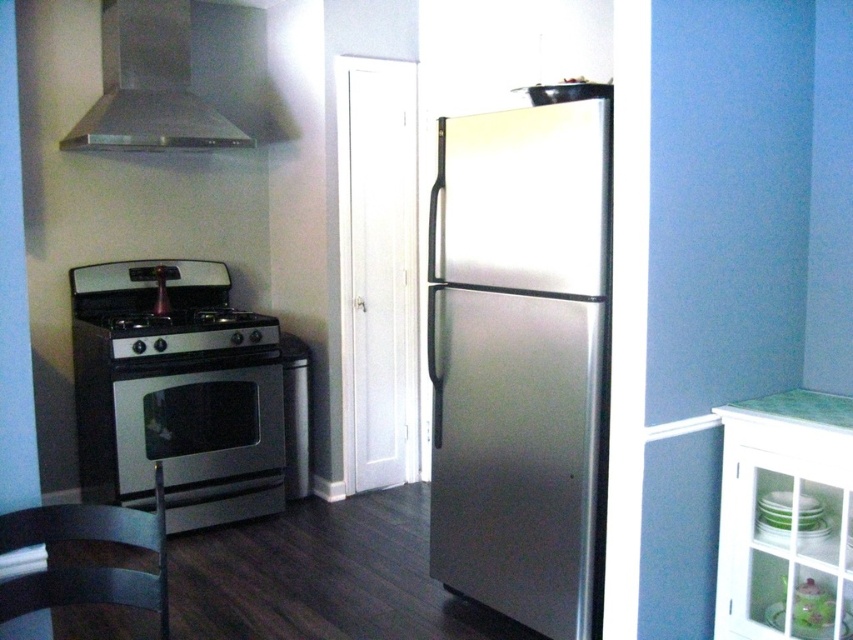
Based on the photo, you are standing in the kitchen and want to grab a snack from the refrigerator. Which object is closer to you, the stainless steel refrigerator at center or the satin silver stove at left?

The stainless steel refrigerator at center is closer to the viewer than the satin silver stove at left, so you would reach the stainless steel refrigerator at center first.

You are organizing a dinner party and need to place a large platter in the kitchen. You have a stainless steel refrigerator at center and a satin silver stove at left. Which appliance should you place the platter on if you want it closer to the right side of the kitchen?

The stainless steel refrigerator at center is positioned on the right side of the satin silver stove at left, so placing the platter on the stainless steel refrigerator at center would place it closer to the right side of the kitchen.